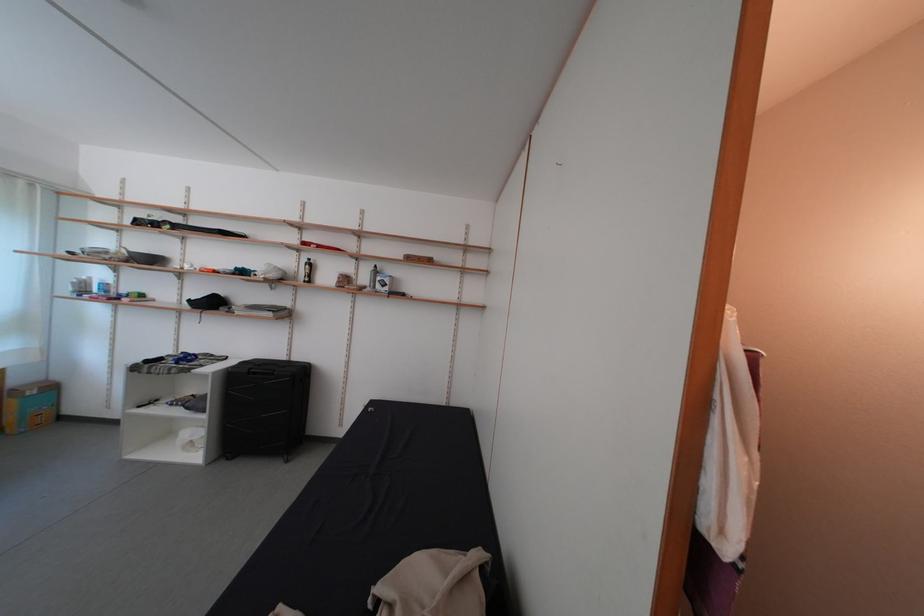
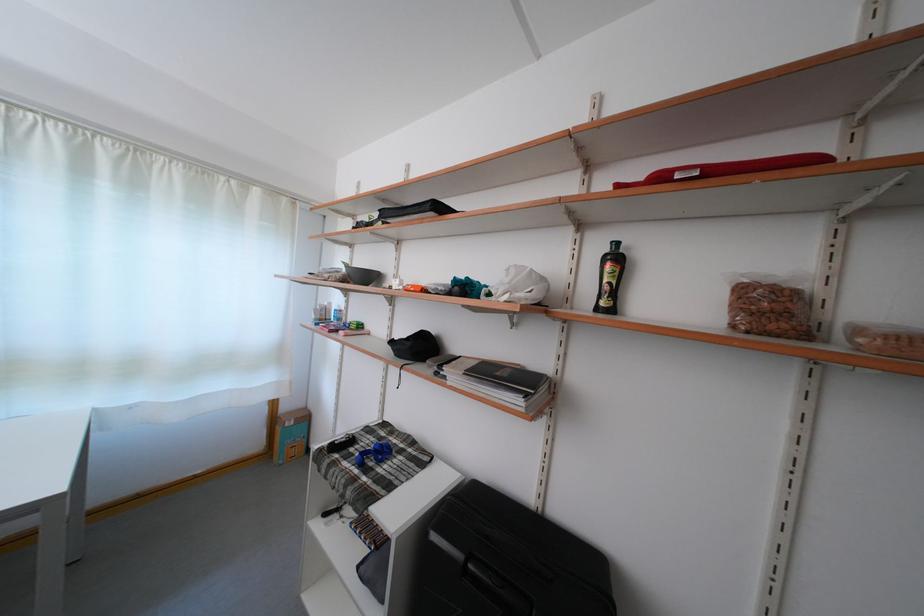
In the second image, find the point that corresponds to point (355, 288) in the first image.

(782, 321)